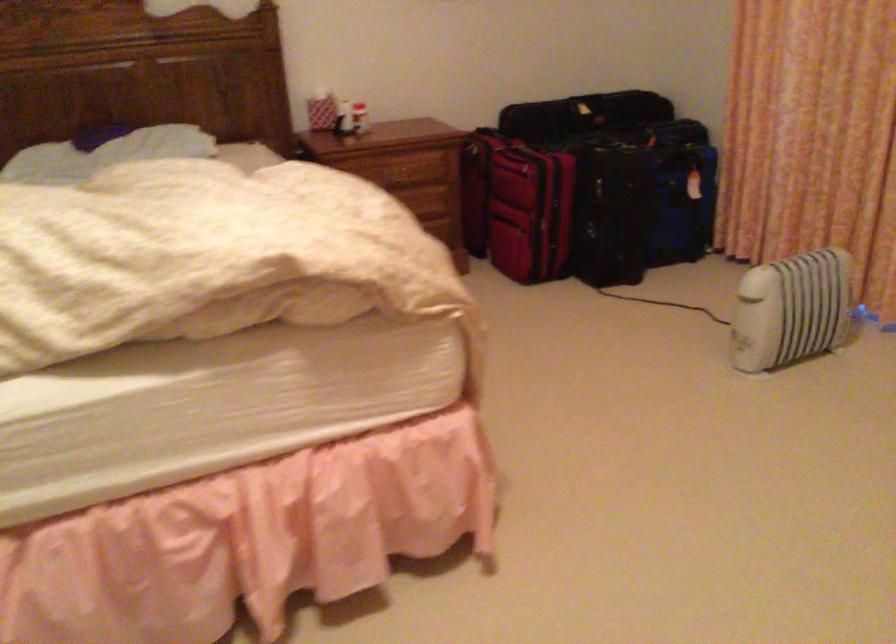
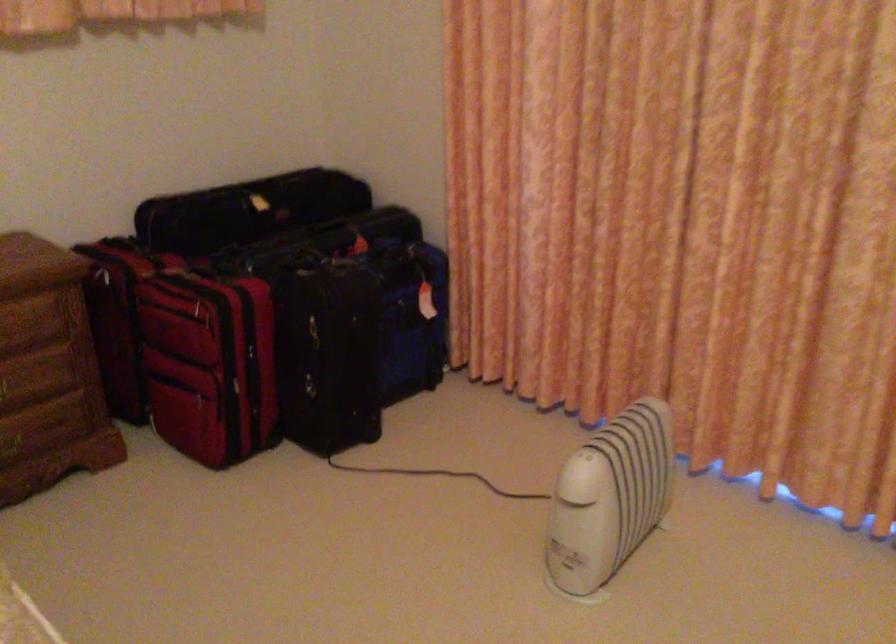
The point at [567,108] is marked in the first image. Where is the corresponding point in the second image?

(247, 210)